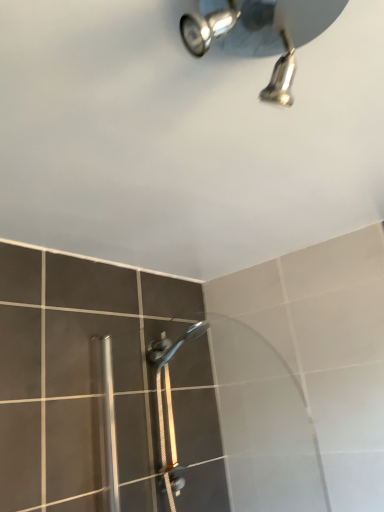
At what (x,y) coordinates should I click in order to perform the action: click on polished chrome shower head at upper center. Please return your answer as a coordinate pair (x, y). Image resolution: width=384 pixels, height=512 pixels. Looking at the image, I should click on (260, 33).

What is the approximate height of polished chrome shower head at upper center?

polished chrome shower head at upper center is 6.00 inches in height.

Describe the element at coordinates (260, 33) in the screenshot. I see `polished chrome shower head at upper center` at that location.

Find the location of a particular element. polished chrome shower head at upper center is located at coordinates (260, 33).